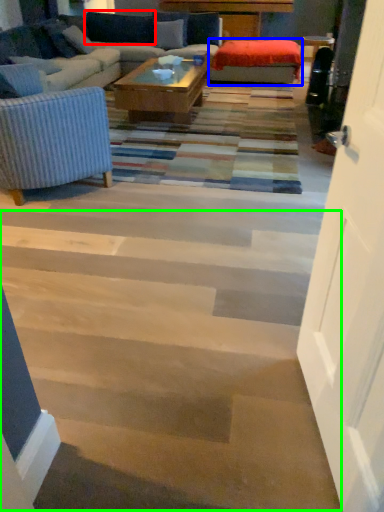
Question: Estimate the real-world distances between objects in this image. Which object is farther from pillow (highlighted by a red box), wide (highlighted by a blue box) or stairwell (highlighted by a green box)?

Choices:
 (A) wide
 (B) stairwell

Answer: (B)